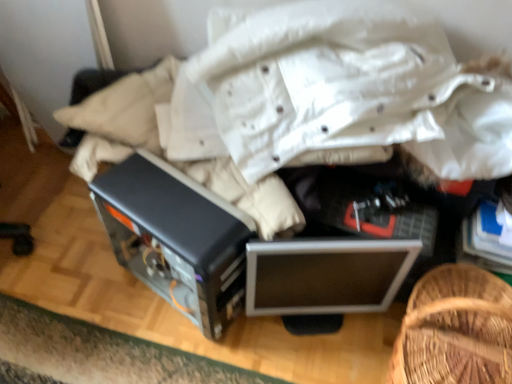
Question: Is woven wood basket at lower right not within satin black computer case at center?

Choices:
 (A) yes
 (B) no

Answer: (A)

Question: From a real-world perspective, is woven wood basket at lower right on satin black computer case at center?

Choices:
 (A) yes
 (B) no

Answer: (A)

Question: Considering the relative sizes of woven wood basket at lower right and satin black computer case at center in the image provided, is woven wood basket at lower right wider than satin black computer case at center?

Choices:
 (A) no
 (B) yes

Answer: (A)

Question: From the image's perspective, is woven wood basket at lower right located above satin black computer case at center?

Choices:
 (A) yes
 (B) no

Answer: (B)

Question: Is the surface of woven wood basket at lower right in direct contact with satin black computer case at center?

Choices:
 (A) yes
 (B) no

Answer: (B)

Question: From the image's perspective, is woven wood basket at lower right beneath satin black computer case at center?

Choices:
 (A) no
 (B) yes

Answer: (B)

Question: Considering the relative positions of woven wood basket at lower right and silver metallic monitor at center in the image provided, is woven wood basket at lower right to the right of silver metallic monitor at center from the viewer's perspective?

Choices:
 (A) no
 (B) yes

Answer: (B)

Question: Are woven wood basket at lower right and silver metallic monitor at center far apart?

Choices:
 (A) yes
 (B) no

Answer: (B)

Question: Can you confirm if woven wood basket at lower right is wider than silver metallic monitor at center?

Choices:
 (A) no
 (B) yes

Answer: (B)

Question: From a real-world perspective, is woven wood basket at lower right beneath silver metallic monitor at center?

Choices:
 (A) yes
 (B) no

Answer: (B)

Question: Is woven wood basket at lower right facing towards silver metallic monitor at center?

Choices:
 (A) no
 (B) yes

Answer: (A)

Question: Considering the relative sizes of woven wood basket at lower right and silver metallic monitor at center in the image provided, is woven wood basket at lower right taller than silver metallic monitor at center?

Choices:
 (A) no
 (B) yes

Answer: (B)

Question: Can you confirm if silver metallic monitor at center is thinner than woven wood basket at lower right?

Choices:
 (A) yes
 (B) no

Answer: (A)